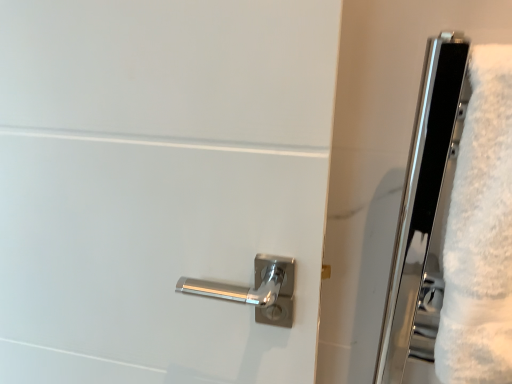
Where is `white fluffy bath towel at right`? This screenshot has height=384, width=512. white fluffy bath towel at right is located at coordinates (480, 233).

The height and width of the screenshot is (384, 512). What do you see at coordinates (480, 233) in the screenshot?
I see `white fluffy bath towel at right` at bounding box center [480, 233].

Describe the element at coordinates (160, 184) in the screenshot. I see `polished metal handle at center` at that location.

What are the coordinates of `polished metal handle at center` in the screenshot? It's located at 160,184.

Locate an element on the screen. white fluffy bath towel at right is located at coordinates (480, 233).

Between white fluffy bath towel at right and polished metal handle at center, which one appears on the right side from the viewer's perspective?

white fluffy bath towel at right is more to the right.

Looking at this image, does white fluffy bath towel at right lie behind polished metal handle at center?

No, the depth of white fluffy bath towel at right is less than that of polished metal handle at center.

Which is nearer, (x=506, y=316) or (x=111, y=323)?

Point (x=506, y=316)

From the image's perspective, relative to polished metal handle at center, is white fluffy bath towel at right above or below?

Based on their image positions, white fluffy bath towel at right is located above polished metal handle at center.

From a real-world perspective, is white fluffy bath towel at right located higher than polished metal handle at center?

Yes, from a real-world perspective, white fluffy bath towel at right is on top of polished metal handle at center.

Considering the sizes of white fluffy bath towel at right and polished metal handle at center in the image, is white fluffy bath towel at right wider or thinner than polished metal handle at center?

white fluffy bath towel at right is wider than polished metal handle at center.

Looking at this image, between white fluffy bath towel at right and polished metal handle at center, which one has less height?

white fluffy bath towel at right.

Between white fluffy bath towel at right and polished metal handle at center, which one has larger size?

Bigger between the two is polished metal handle at center.

Is polished metal handle at center inside white fluffy bath towel at right?

No, white fluffy bath towel at right does not contain polished metal handle at center.

Is the surface of white fluffy bath towel at right in direct contact with polished metal handle at center?

white fluffy bath towel at right is not next to polished metal handle at center, and they're not touching.

Is white fluffy bath towel at right oriented towards polished metal handle at center?

No, white fluffy bath towel at right does not turn towards polished metal handle at center.

How different are the orientations of white fluffy bath towel at right and polished metal handle at center in degrees?

white fluffy bath towel at right and polished metal handle at center are facing 1.23 degrees away from each other.

How distant is white fluffy bath towel at right from polished metal handle at center?

white fluffy bath towel at right and polished metal handle at center are 13.14 inches apart.

Find the location of `bath towel located on the right of polished metal handle at center`. bath towel located on the right of polished metal handle at center is located at coordinates (480, 233).

Based on the photo, is polished metal handle at center to the right of white fluffy bath towel at right from the viewer's perspective?

No.

Is polished metal handle at center positioned in front of white fluffy bath towel at right?

No.

Which point is more forward, (215,325) or (475,320)?

The point (475,320) is closer to the camera.

From the image's perspective, would you say polished metal handle at center is shown under white fluffy bath towel at right?

Yes, from the image's perspective, polished metal handle at center is beneath white fluffy bath towel at right.

From a real-world perspective, is polished metal handle at center on white fluffy bath towel at right?

No, from a real-world perspective, polished metal handle at center is not over white fluffy bath towel at right

Considering the sizes of polished metal handle at center and white fluffy bath towel at right in the image, is polished metal handle at center wider or thinner than white fluffy bath towel at right?

polished metal handle at center is thinner than white fluffy bath towel at right.

Which of these two, polished metal handle at center or white fluffy bath towel at right, stands taller?

With more height is polished metal handle at center.

Considering the relative sizes of polished metal handle at center and white fluffy bath towel at right in the image provided, is polished metal handle at center bigger than white fluffy bath towel at right?

Correct, polished metal handle at center is larger in size than white fluffy bath towel at right.

Is polished metal handle at center surrounding white fluffy bath towel at right?

No.

Are polished metal handle at center and white fluffy bath towel at right making contact?

No, polished metal handle at center is not in contact with white fluffy bath towel at right.

Is polished metal handle at center aimed at white fluffy bath towel at right?

No, polished metal handle at center is not oriented towards white fluffy bath towel at right.

How far apart are polished metal handle at center and white fluffy bath towel at right?

13.14 inches.

Locate an element on the screen. Image resolution: width=512 pixels, height=384 pixels. bath towel above the polished metal handle at center (from the image's perspective) is located at coordinates (480, 233).

There is a polished metal handle at center. Where is `bath towel above it (from a real-world perspective)`? This screenshot has height=384, width=512. bath towel above it (from a real-world perspective) is located at coordinates (480, 233).

Image resolution: width=512 pixels, height=384 pixels. I want to click on door below the white fluffy bath towel at right (from the image's perspective), so click(x=160, y=184).